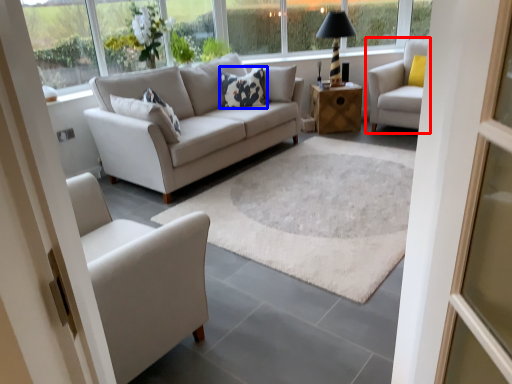
Question: Which of the following is the closest to the observer, chair (highlighted by a red box) or pillow (highlighted by a blue box)?

Choices:
 (A) chair
 (B) pillow

Answer: (A)